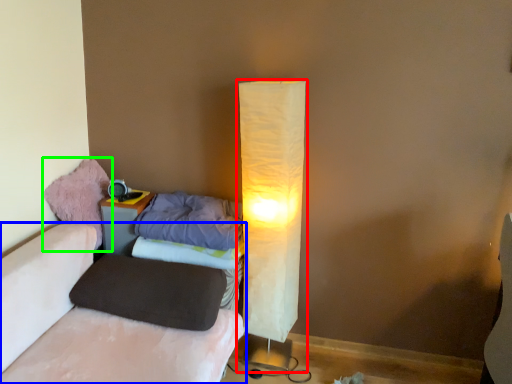
Question: Which object is the farthest from lamp (highlighted by a red box)? Choose among these: furniture (highlighted by a blue box) or bean bag chair (highlighted by a green box).

Choices:
 (A) furniture
 (B) bean bag chair

Answer: (B)